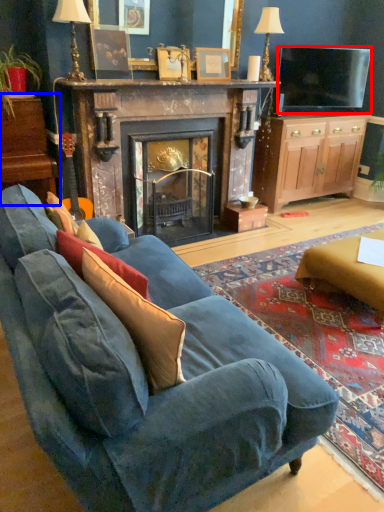
Question: Which point is closer to the camera, television (highlighted by a red box) or dresser (highlighted by a blue box)?

Choices:
 (A) television
 (B) dresser

Answer: (B)